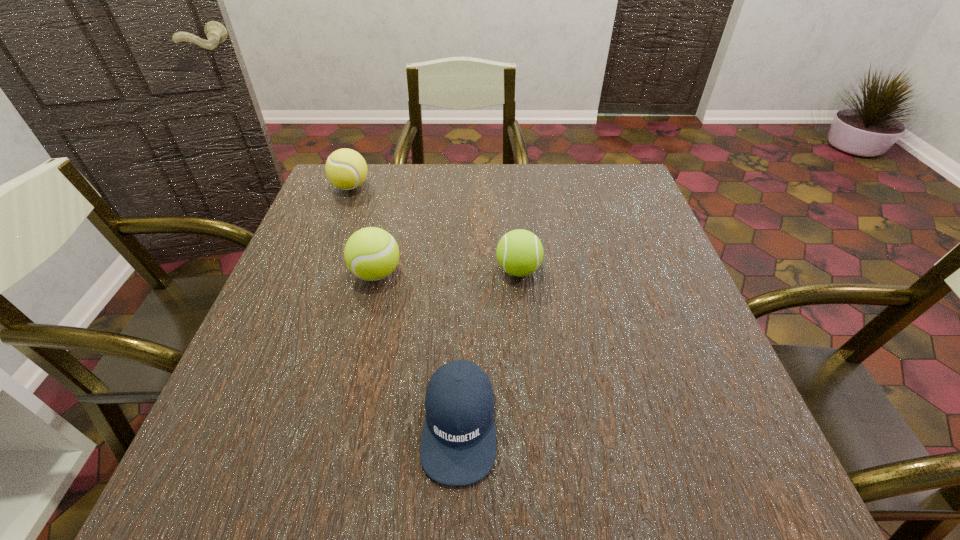
You are a GUI agent. You are given a task and a screenshot of the screen. Output one action in this format:
    pyautogui.click(x=<x>, y=<y>)
    Task: Click on the vacant region between the second object from right to left and the third object from right to left
    
    Given the screenshot: What is the action you would take?
    pyautogui.click(x=418, y=349)

Image resolution: width=960 pixels, height=540 pixels. I want to click on free spot between the rightmost object and the leftmost tennis ball, so click(435, 228).

The height and width of the screenshot is (540, 960). In order to click on vacant area that lies between the rightmost tennis ball and the shortest object in this screenshot , I will do (489, 347).

Identify the location of free spot between the nearest object and the second object from left to right. (418, 349).

In order to click on empty location between the second object from left to right and the rightmost object in this screenshot , I will do `click(447, 272)`.

I want to click on vacant space that's between the second tennis ball from right to left and the shortest object, so click(418, 349).

Locate an element on the screen. vacant area that lies between the shortest object and the third object from right to left is located at coordinates (418, 349).

Locate an element on the screen. the closest object relative to the second tennis ball from left to right is located at coordinates (519, 252).

The image size is (960, 540). What are the coordinates of `object that is the second nearest to the leftmost tennis ball` in the screenshot? It's located at (519, 252).

Locate which tennis ball is the second closest to the second object from left to right. Please provide its 2D coordinates. Your answer should be formatted as a tuple, i.e. [(x, y)], where the tuple contains the x and y coordinates of a point satisfying the conditions above.

[(346, 169)]